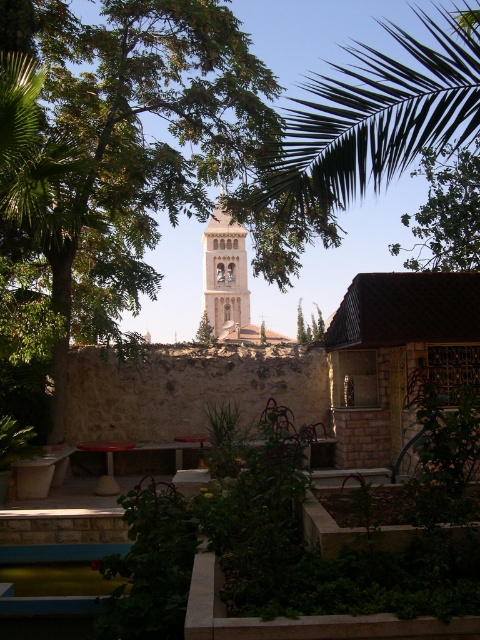
Question: Is green leafy palm at upper center to the left of light beige stone bell tower at center from the viewer's perspective?

Choices:
 (A) yes
 (B) no

Answer: (B)

Question: Is green leafy tree at upper right above light beige stone bell tower at center?

Choices:
 (A) yes
 (B) no

Answer: (A)

Question: Which object is closer to the camera taking this photo?

Choices:
 (A) green leafy tree at upper right
 (B) green leafy tree at center
 (C) green leafy palm at upper center

Answer: (C)

Question: Among these objects, which one is farthest from the camera?

Choices:
 (A) green leafy palm at upper center
 (B) green leafy tree at upper right
 (C) light beige stone bell tower at center

Answer: (C)

Question: Can you confirm if green leafy tree at center is wider than green leafy tree at upper right?

Choices:
 (A) no
 (B) yes

Answer: (A)

Question: Which point is farther to the camera?

Choices:
 (A) (432, 20)
 (B) (214, 252)
 (C) (72, 259)

Answer: (B)